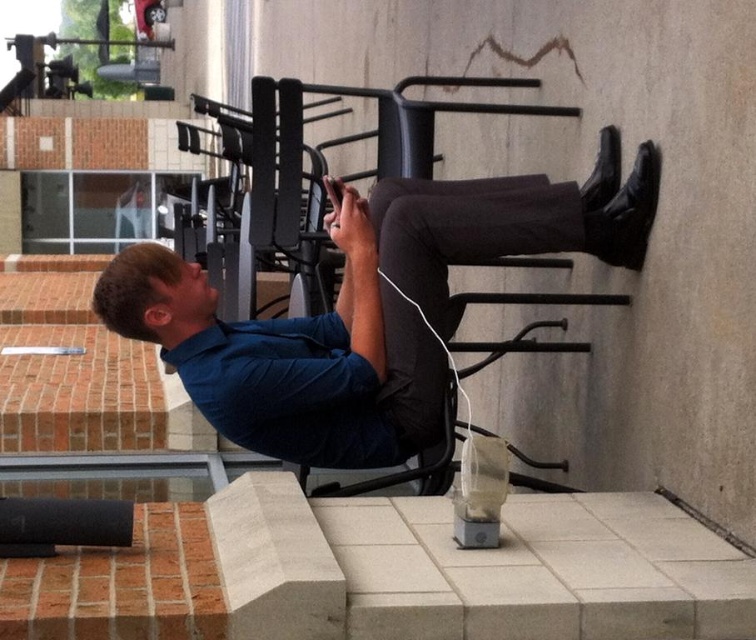
This screenshot has height=640, width=756. What do you see at coordinates (370, 307) in the screenshot?
I see `blue cotton shirt at upper center` at bounding box center [370, 307].

This screenshot has width=756, height=640. What do you see at coordinates (370, 307) in the screenshot?
I see `blue cotton shirt at upper center` at bounding box center [370, 307].

The image size is (756, 640). In order to click on blue cotton shirt at upper center in this screenshot , I will do `click(370, 307)`.